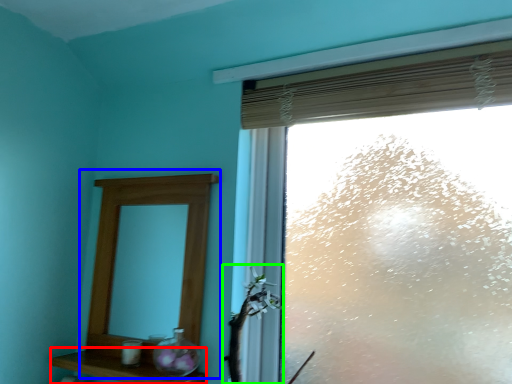
Question: Based on their relative distances, which object is nearer to shelf (highlighted by a red box)? Choose from medicine cabinet (highlighted by a blue box) and plant (highlighted by a green box).

Choices:
 (A) medicine cabinet
 (B) plant

Answer: (A)